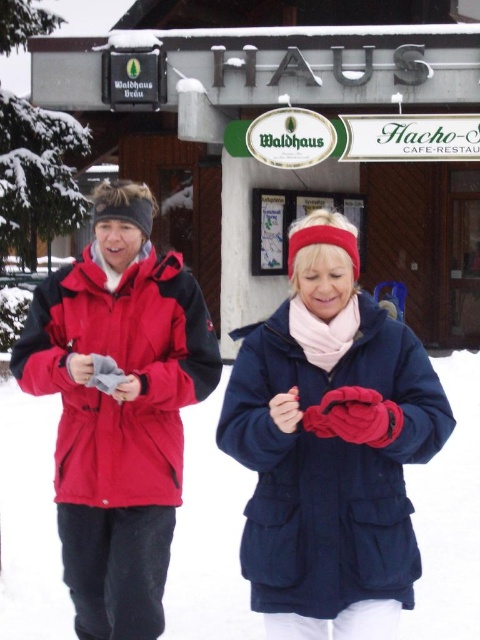
Question: Which object is closer to the camera taking this photo?

Choices:
 (A) navy blue cotton jacket at center
 (B) matte red jacket at left

Answer: (A)

Question: Does navy blue cotton jacket at center appear on the right side of matte red jacket at left?

Choices:
 (A) yes
 (B) no

Answer: (A)

Question: Estimate the real-world distances between objects in this image. Which object is closer to the navy blue cotton jacket at center?

Choices:
 (A) matte red jacket at center
 (B) matte red jacket at left

Answer: (B)

Question: Is matte red jacket at center positioned behind navy blue cotton jacket at center?

Choices:
 (A) yes
 (B) no

Answer: (A)

Question: Is matte red jacket at center wider than navy blue cotton jacket at center?

Choices:
 (A) yes
 (B) no

Answer: (A)

Question: Which point is closer to the camera taking this photo?

Choices:
 (A) (335, 419)
 (B) (307, 433)
 (C) (88, 428)

Answer: (A)